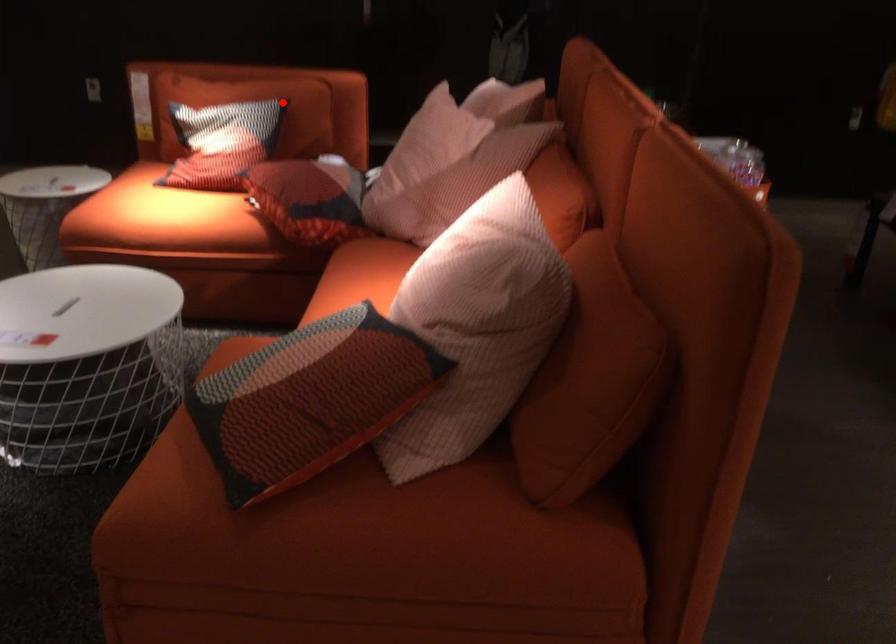
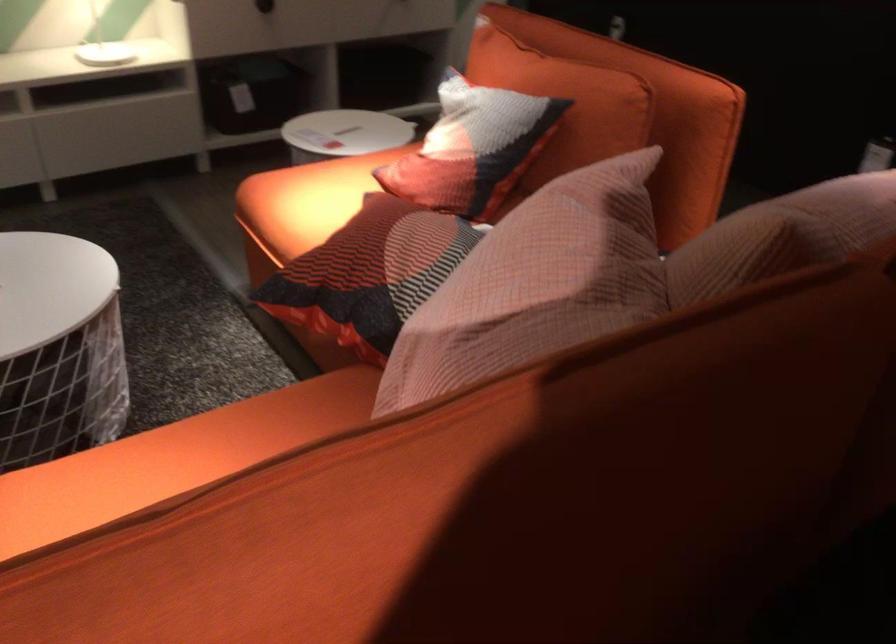
The point at the highlighted location is marked in the first image. Where is the corresponding point in the second image?

(564, 102)